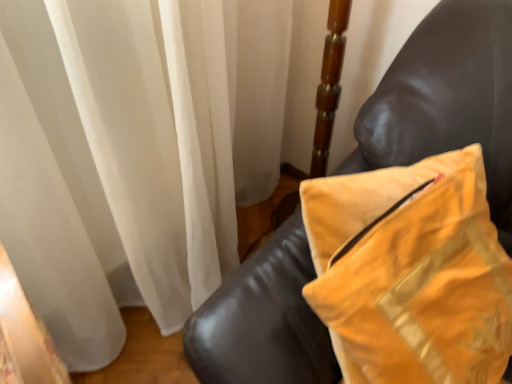
Question: Is yellow velvet pillow at upper right wider than leather couch at right?

Choices:
 (A) no
 (B) yes

Answer: (A)

Question: Is yellow velvet pillow at upper right looking in the opposite direction of leather couch at right?

Choices:
 (A) yes
 (B) no

Answer: (A)

Question: Is yellow velvet pillow at upper right at the left side of leather couch at right?

Choices:
 (A) yes
 (B) no

Answer: (B)

Question: Considering the relative sizes of yellow velvet pillow at upper right and leather couch at right in the image provided, is yellow velvet pillow at upper right thinner than leather couch at right?

Choices:
 (A) no
 (B) yes

Answer: (B)

Question: Can you confirm if yellow velvet pillow at upper right is bigger than leather couch at right?

Choices:
 (A) yes
 (B) no

Answer: (B)

Question: Can we say yellow velvet pillow at upper right lies outside leather couch at right?

Choices:
 (A) yes
 (B) no

Answer: (A)

Question: Does leather couch at right have a larger size compared to yellow velvet pillow at upper right?

Choices:
 (A) yes
 (B) no

Answer: (A)

Question: Does leather couch at right lie in front of yellow velvet pillow at upper right?

Choices:
 (A) yes
 (B) no

Answer: (B)

Question: Are leather couch at right and yellow velvet pillow at upper right making contact?

Choices:
 (A) yes
 (B) no

Answer: (B)

Question: Considering the relative sizes of leather couch at right and yellow velvet pillow at upper right in the image provided, is leather couch at right shorter than yellow velvet pillow at upper right?

Choices:
 (A) yes
 (B) no

Answer: (B)

Question: From the image's perspective, does leather couch at right appear lower than yellow velvet pillow at upper right?

Choices:
 (A) yes
 (B) no

Answer: (B)

Question: Is leather couch at right not within yellow velvet pillow at upper right?

Choices:
 (A) yes
 (B) no

Answer: (A)

Question: In the image, is yellow velvet pillow at upper right positioned in front of or behind leather couch at right?

Choices:
 (A) behind
 (B) front

Answer: (B)